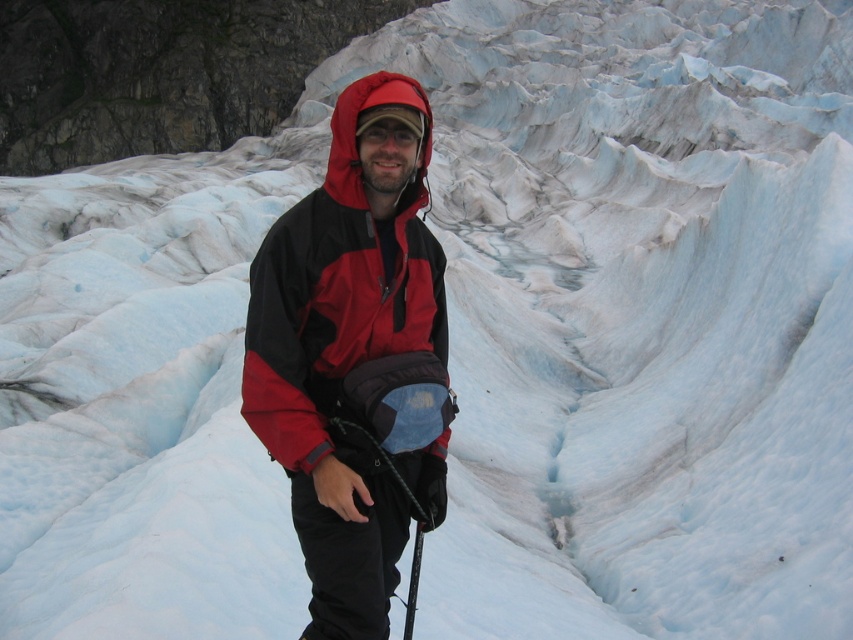
Question: Is red matte jacket at center above black rubber ski pole at lower center?

Choices:
 (A) yes
 (B) no

Answer: (A)

Question: Which of the following is the closest to the observer?

Choices:
 (A) black rubber ski pole at lower center
 (B) red matte jacket at center

Answer: (B)

Question: Where is red matte jacket at center located in relation to black rubber ski pole at lower center in the image?

Choices:
 (A) right
 (B) left

Answer: (B)

Question: Which point is farther from the camera taking this photo?

Choices:
 (A) (426, 138)
 (B) (418, 544)

Answer: (A)

Question: Does red matte jacket at center appear under black rubber ski pole at lower center?

Choices:
 (A) no
 (B) yes

Answer: (A)

Question: Among these objects, which one is nearest to the camera?

Choices:
 (A) black rubber ski pole at lower center
 (B) red matte jacket at center

Answer: (B)